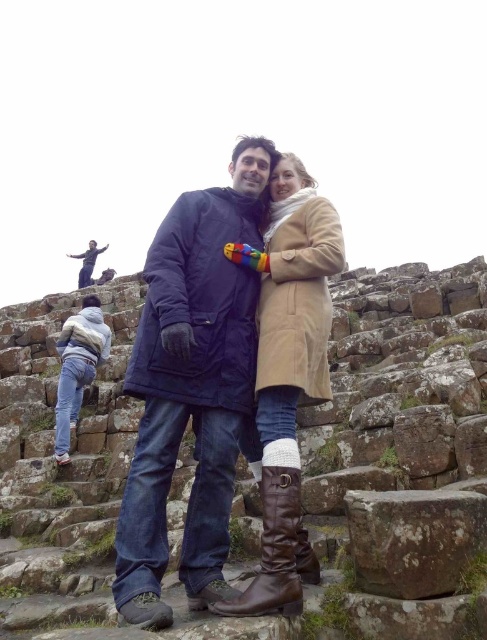
You are a photographer trying to capture a photo of the rusty stone at center without the beige suede coat at center blocking the view. Can you move either the photographer or the objects to achieve this?

The beige suede coat at center is in front of the rusty stone at center. To avoid blocking the view, the photographer should move to a different angle or position so that the rusty stone at center is no longer behind the beige suede coat at center.

Looking at this image, you are a photographer trying to capture a photo of the dark blue woolen coat at center and the brown leather boot at center. Which object should you focus on first to ensure both are in sharp focus?

The dark blue woolen coat at center is closer to the viewer than the brown leather boot at center, so you should focus on the dark blue woolen coat at center first to ensure both are in sharp focus.